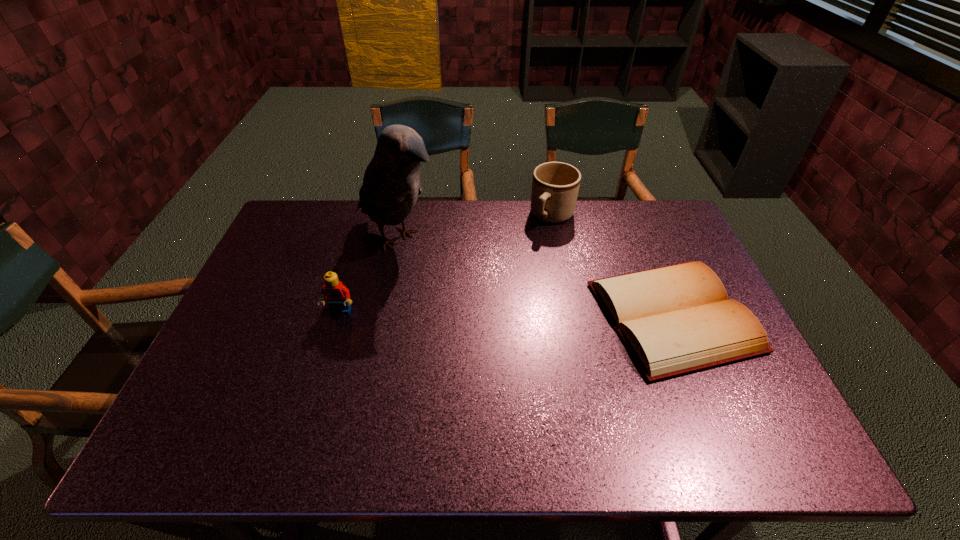
Locate an element on the screen. vacant space that is in between the mug and the shortest object is located at coordinates (612, 266).

The height and width of the screenshot is (540, 960). What are the coordinates of `free space between the Lego and the Bible` in the screenshot? It's located at (507, 314).

At what (x,y) coordinates should I click in order to perform the action: click on vacant space that's between the tallest object and the Lego. Please return your answer as a coordinate pair (x, y). This screenshot has height=540, width=960. Looking at the image, I should click on (369, 276).

Select which object is the third closest to the tallest object. Please provide its 2D coordinates. Your answer should be formatted as a tuple, i.e. [(x, y)], where the tuple contains the x and y coordinates of a point satisfying the conditions above.

[(677, 319)]

Choose which object is the second nearest neighbor to the mug. Please provide its 2D coordinates. Your answer should be formatted as a tuple, i.e. [(x, y)], where the tuple contains the x and y coordinates of a point satisfying the conditions above.

[(391, 184)]

Image resolution: width=960 pixels, height=540 pixels. I want to click on vacant region that satisfies the following two spatial constraints: 1. on the face of the Lego; 2. on the right side of the shortest object, so click(339, 316).

Find the location of `free point that satisfies the following two spatial constraints: 1. on the back side of the mug; 2. on the right side of the tallest object`. free point that satisfies the following two spatial constraints: 1. on the back side of the mug; 2. on the right side of the tallest object is located at coordinates (402, 216).